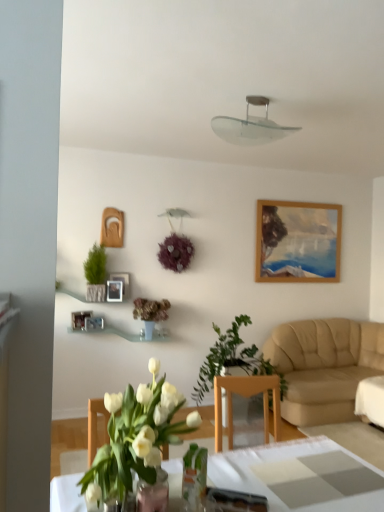
What is the approximate height of white glossy tulips at center, which appears as the 1th houseplant when viewed from the front?

It is 17.44 inches.

Measure the distance between clear glass lampshade at upper center and camera.

They are 8.77 feet apart.

Locate an element on the screen. clear glass vase at center is located at coordinates (153, 494).

Image resolution: width=384 pixels, height=512 pixels. I want to click on wooden photo frame at upper left, arranged as the third picture frame when viewed from the right, so click(x=79, y=319).

Which of these two, translucent glass vase at center, marked as the second houseplant in a left-to-right arrangement, or clear glass lampshade at upper center, stands taller?

translucent glass vase at center, marked as the second houseplant in a left-to-right arrangement, is taller.

Would you say translucent glass vase at center, which is counted as the 1th houseplant, starting from the back, is inside or outside clear glass lampshade at upper center?

translucent glass vase at center, which is counted as the 1th houseplant, starting from the back, cannot be found inside clear glass lampshade at upper center.

Relative to clear glass lampshade at upper center, is translucent glass vase at center, the fourth houseplant in the front-to-back sequence, in front or behind?

Visually, translucent glass vase at center, the fourth houseplant in the front-to-back sequence, is located behind clear glass lampshade at upper center.

Between translucent glass vase at center, the third houseplant in the right-to-left sequence, and clear glass lampshade at upper center, which one has smaller size?

clear glass lampshade at upper center is smaller.

Could you tell me if wooden photo frame at upper center, which ranks as the second picture frame in right-to-left order, is turned towards green matte plant at left, acting as the 2th houseplant starting from the back?

No, wooden photo frame at upper center, which ranks as the second picture frame in right-to-left order, is not turned towards green matte plant at left, acting as the 2th houseplant starting from the back.

Who is more distant, wooden photo frame at upper center, the second picture frame when ordered from left to right, or green matte plant at left, the 4th houseplant when ordered from right to left?

wooden photo frame at upper center, the second picture frame when ordered from left to right, is further away from the camera.

From the image's perspective, does wooden photo frame at upper center, which ranks as the second picture frame in right-to-left order, appear lower than green matte plant at left, marked as the third houseplant in a front-to-back arrangement?

Indeed, from the image's perspective, wooden photo frame at upper center, which ranks as the second picture frame in right-to-left order, is shown beneath green matte plant at left, marked as the third houseplant in a front-to-back arrangement.

Who is shorter, wooden photo frame at upper center, the second picture frame when ordered from left to right, or green matte plant at left, the 1th houseplant when ordered from left to right?

wooden photo frame at upper center, the second picture frame when ordered from left to right, is shorter.

Is beige leather couch at right in contact with green matte plant at left, the 1th houseplant when ordered from left to right?

No, beige leather couch at right is not making contact with green matte plant at left, the 1th houseplant when ordered from left to right.

In the image, there is a green matte plant at left, acting as the 2th houseplant starting from the back. Identify the location of studio couch below it (from the image's perspective). click(x=324, y=366).

Considering the positions of point (275, 350) and point (105, 267), is point (275, 350) closer or farther from the camera than point (105, 267)?

Point (275, 350) appears to be farther away from the viewer than point (105, 267).

From a real-world perspective, who is located lower, green leafy plant at center, placed as the 1th houseplant when sorted from right to left, or green matte plant at left, the 1th houseplant when ordered from left to right?

green leafy plant at center, placed as the 1th houseplant when sorted from right to left, from a real-world perspective.

The height and width of the screenshot is (512, 384). Identify the location of the 3rd houseplant to the right of the green matte plant at left, the 4th houseplant when ordered from right to left, starting your count from the anchor. (233, 360).

How far apart are green leafy plant at center, which ranks as the 4th houseplant in left-to-right order, and green matte plant at left, acting as the 2th houseplant starting from the back?

The distance of green leafy plant at center, which ranks as the 4th houseplant in left-to-right order, from green matte plant at left, acting as the 2th houseplant starting from the back, is 4.43 feet.

From the image's perspective, would you say green leafy plant at center, placed as the 1th houseplant when sorted from right to left, is shown under green matte plant at left, the 4th houseplant when ordered from right to left?

Yes, from the image's perspective, green leafy plant at center, placed as the 1th houseplant when sorted from right to left, is below green matte plant at left, the 4th houseplant when ordered from right to left.

Can you tell me how much clear glass lampshade at upper center and wooden photo frame at upper left, arranged as the third picture frame when viewed from the right, differ in facing direction?

23.3 degrees.

Does point (274, 138) lie in front of point (82, 323)?

Yes, point (274, 138) is in front of point (82, 323).

Considering their positions, is clear glass lampshade at upper center located in front of or behind wooden photo frame at upper left, which is the 1th picture frame from left to right?

Visually, clear glass lampshade at upper center is located in front of wooden photo frame at upper left, which is the 1th picture frame from left to right.

Measure the distance between clear glass lampshade at upper center and wooden photo frame at upper left, arranged as the third picture frame when viewed from the right.

clear glass lampshade at upper center and wooden photo frame at upper left, arranged as the third picture frame when viewed from the right, are 2.28 meters apart.

From the image's perspective, which one is positioned lower, white glossy table at center or wooden photo frame at upper left, the first picture frame in the right-to-left sequence?

white glossy table at center appears lower in the image.

Can you confirm if white glossy table at center is taller than wooden photo frame at upper left, the first picture frame in the right-to-left sequence?

Yes.

Between white glossy table at center and wooden photo frame at upper left, the first picture frame in the right-to-left sequence, which one has smaller size?

Smaller between the two is wooden photo frame at upper left, the first picture frame in the right-to-left sequence.

Is white glossy table at center not near wooden photo frame at upper left, marked as the 3th picture frame in a left-to-right arrangement?

Yes, white glossy table at center and wooden photo frame at upper left, marked as the 3th picture frame in a left-to-right arrangement, are located far from each other.

Where is `picture frame that is the 1st object located above the translucent glass vase at center, which is counted as the 1th houseplant, starting from the back (from the image's perspective)`? The width and height of the screenshot is (384, 512). picture frame that is the 1st object located above the translucent glass vase at center, which is counted as the 1th houseplant, starting from the back (from the image's perspective) is located at coordinates (79, 319).

Considering the positions of objects translucent glass vase at center, the fourth houseplant in the front-to-back sequence, and wooden photo frame at upper left, which is the 1th picture frame from left to right, in the image provided, who is more to the right, translucent glass vase at center, the fourth houseplant in the front-to-back sequence, or wooden photo frame at upper left, which is the 1th picture frame from left to right,?

translucent glass vase at center, the fourth houseplant in the front-to-back sequence.

Who is taller, translucent glass vase at center, marked as the second houseplant in a left-to-right arrangement, or wooden photo frame at upper left, arranged as the third picture frame when viewed from the right?

translucent glass vase at center, marked as the second houseplant in a left-to-right arrangement, is taller.

From the image's perspective, would you say translucent glass vase at center, which is counted as the 1th houseplant, starting from the back, is positioned over wooden photo frame at upper left, arranged as the third picture frame when viewed from the right?

Actually, translucent glass vase at center, which is counted as the 1th houseplant, starting from the back, appears below wooden photo frame at upper left, arranged as the third picture frame when viewed from the right, in the image.

Where is `houseplant that is the 3rd one when counting leftward from the clear glass lampshade at upper center`? The height and width of the screenshot is (512, 384). houseplant that is the 3rd one when counting leftward from the clear glass lampshade at upper center is located at coordinates (150, 313).

Locate an element on the screen. the 2nd houseplant in front of the wooden photo frame at upper center, which ranks as the second picture frame in right-to-left order, counting from the anchor's position is located at coordinates (96, 273).

Estimate the real-world distances between objects in this image. Which object is further from clear glass vase at center, wooden photo frame at upper left, marked as the 3th picture frame in a left-to-right arrangement, or green matte plant at left, acting as the 2th houseplant starting from the back?

The object further to clear glass vase at center is wooden photo frame at upper left, marked as the 3th picture frame in a left-to-right arrangement.

When comparing their distances from wooden photo frame at upper center, the second picture frame when ordered from left to right, does white glossy tulips at center, the 3th houseplant from the left, or wooden photo frame at upper left, the first picture frame in the right-to-left sequence, seem further?

white glossy tulips at center, the 3th houseplant from the left, is further to wooden photo frame at upper center, the second picture frame when ordered from left to right.

Based on the photo, considering their positions, is beige leather couch at right positioned further to translucent glass vase at center, the fourth houseplant in the front-to-back sequence, than wooden photo frame at upper left, arranged as the third picture frame when viewed from the right?

beige leather couch at right is further to translucent glass vase at center, the fourth houseplant in the front-to-back sequence.

Which object lies further to the anchor point clear glass lampshade at upper center, clear glass vase at center or green leafy plant at center, placed as the 1th houseplant when sorted from right to left?

The object further to clear glass lampshade at upper center is clear glass vase at center.

From the image, which object appears to be nearer to green leafy plant at center, which ranks as the 4th houseplant in left-to-right order, wooden photo frame at upper left, which is the 1th picture frame from left to right, or wooden photo frame at upper left, the first picture frame in the right-to-left sequence?

Based on the image, wooden photo frame at upper left, the first picture frame in the right-to-left sequence, appears to be nearer to green leafy plant at center, which ranks as the 4th houseplant in left-to-right order.

When comparing their distances from white glossy table at center, does clear glass lampshade at upper center or clear glass vase at center seem closer?

clear glass vase at center is closer to white glossy table at center.

From the image, which object appears to be farther from wooden photo frame at upper left, the first picture frame in the right-to-left sequence, clear glass lampshade at upper center or wooden photo frame at upper center, the second picture frame when ordered from left to right?

The object further to wooden photo frame at upper left, the first picture frame in the right-to-left sequence, is clear glass lampshade at upper center.

Based on their spatial positions, is purple feather wreath at center or white glossy table at center further from beige leather couch at right?

Based on the image, white glossy table at center appears to be further to beige leather couch at right.

Find the location of `lamp between white glossy table at center and wooden photo frame at upper left, arranged as the third picture frame when viewed from the right, in the front-back direction`. lamp between white glossy table at center and wooden photo frame at upper left, arranged as the third picture frame when viewed from the right, in the front-back direction is located at coordinates (251, 126).

Find the location of a particular element. This screenshot has height=512, width=384. studio couch between clear glass vase at center and purple feather wreath at center from front to back is located at coordinates (324, 366).

Identify the location of lamp between white glossy tulips at center, marked as the 4th houseplant in a back-to-front arrangement, and purple feather wreath at center from front to back. The image size is (384, 512). (251, 126).

You are a GUI agent. You are given a task and a screenshot of the screen. Output one action in this format:
    pyautogui.click(x=<x>, y=<y>)
    Task: Click on the houseplant positioned between clear glass vase at center and green matte plant at left, the 1th houseplant when ordered from left to right, from near to far
    The height and width of the screenshot is (512, 384).
    Given the screenshot: What is the action you would take?
    pyautogui.click(x=233, y=360)